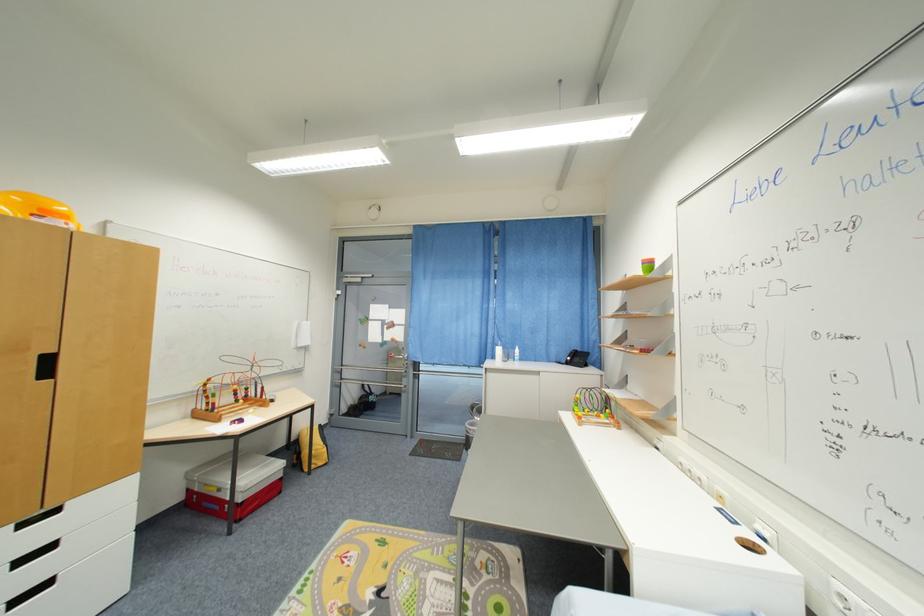
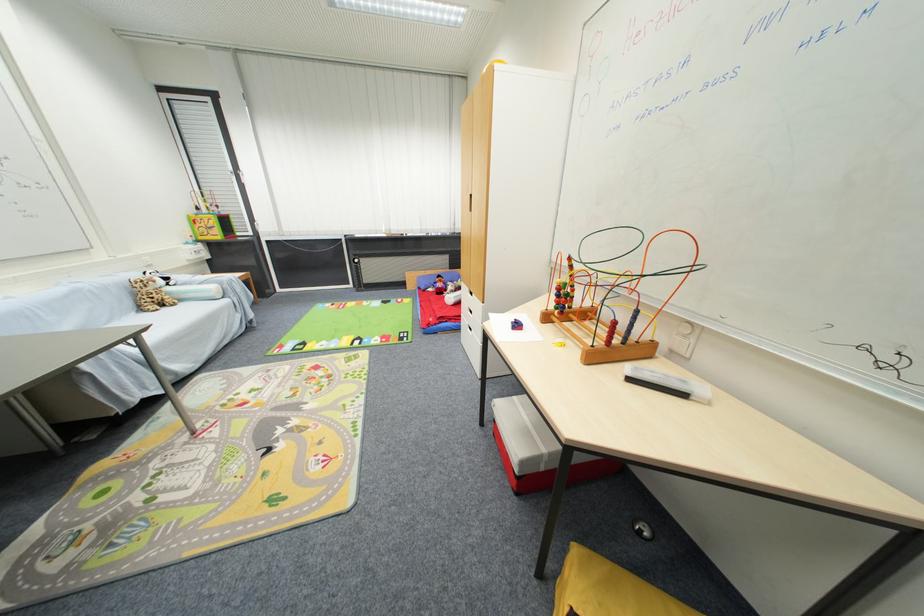
In the second image, find the point that corresponds to point 214,381 in the first image.

(575, 261)